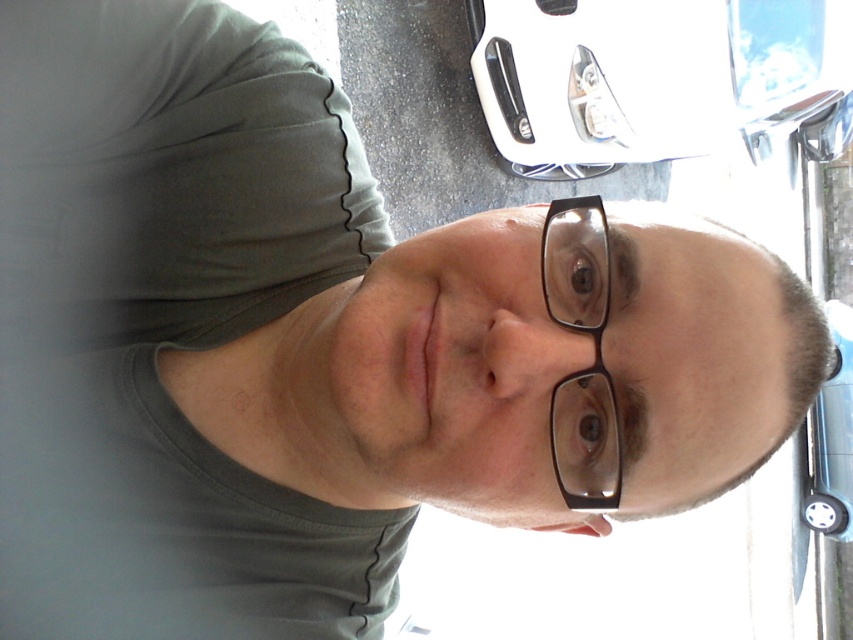
Question: From the image, what is the correct spatial relationship of white glossy bumper at upper center in relation to transparent plastic glasses at center?

Choices:
 (A) right
 (B) left

Answer: (A)

Question: Which of the following is the closest to the observer?

Choices:
 (A) (576, 452)
 (B) (679, 157)

Answer: (A)

Question: Does white glossy bumper at upper center appear under transparent plastic glasses at center?

Choices:
 (A) no
 (B) yes

Answer: (A)

Question: Which object is closer to the camera taking this photo?

Choices:
 (A) transparent plastic glasses at center
 (B) white glossy bumper at upper center

Answer: (A)

Question: Which object is closer to the camera taking this photo?

Choices:
 (A) white glossy bumper at upper center
 (B) transparent plastic glasses at center

Answer: (B)

Question: Does white glossy bumper at upper center appear under transparent plastic glasses at center?

Choices:
 (A) yes
 (B) no

Answer: (B)